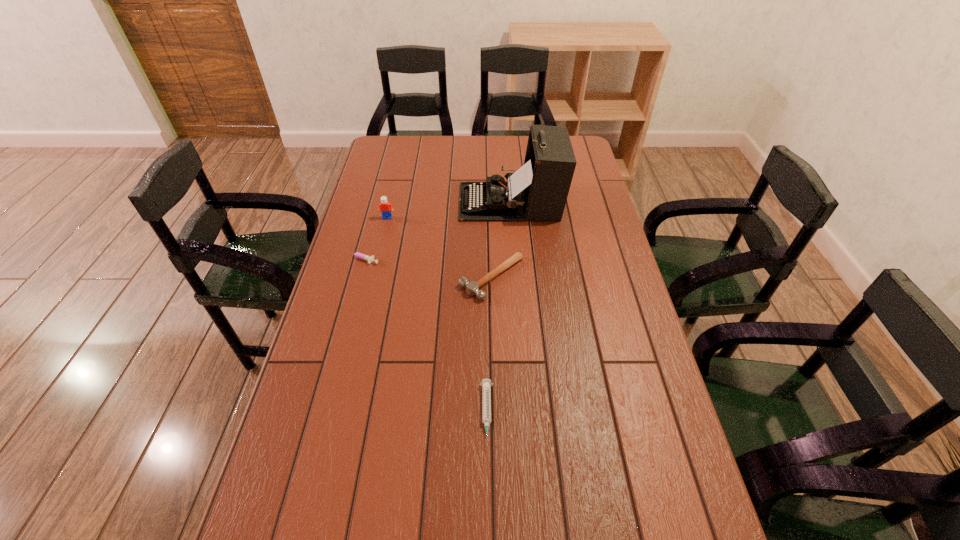
Where is `typewriter`? The width and height of the screenshot is (960, 540). typewriter is located at coordinates (538, 190).

Where is `Lego`? Lego is located at coordinates (385, 207).

Find the location of `the third tallest object`. the third tallest object is located at coordinates (472, 288).

Image resolution: width=960 pixels, height=540 pixels. Identify the location of the nearest object. (486, 384).

In order to click on the right syringe in this screenshot , I will do `click(486, 384)`.

This screenshot has height=540, width=960. In order to click on the farther syringe in this screenshot , I will do `click(358, 255)`.

Find the location of `free space located inside the open case of the typewriter`. free space located inside the open case of the typewriter is located at coordinates (445, 202).

Find the location of a particular element. blank area located inside the open case of the typewriter is located at coordinates (369, 202).

You are a GUI agent. You are given a task and a screenshot of the screen. Output one action in this format:
    pyautogui.click(x=<x>, y=<y>)
    Task: Click on the free point located inside the open case of the typewriter
    The width and height of the screenshot is (960, 540).
    Given the screenshot: What is the action you would take?
    pyautogui.click(x=411, y=202)

This screenshot has height=540, width=960. In order to click on free space located 0.070m on the face of the Lego in this screenshot , I will do `click(384, 232)`.